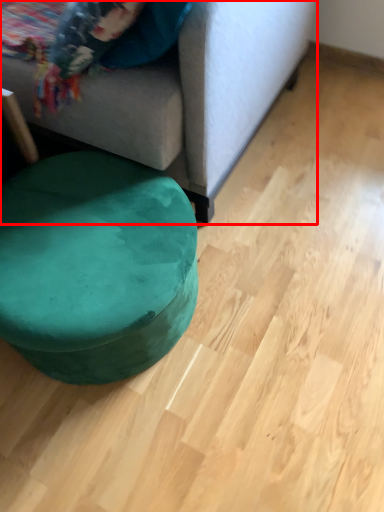
Question: From the image's perspective, where is studio couch (annotated by the red box) located relative to bean bag chair?

Choices:
 (A) below
 (B) above

Answer: (B)